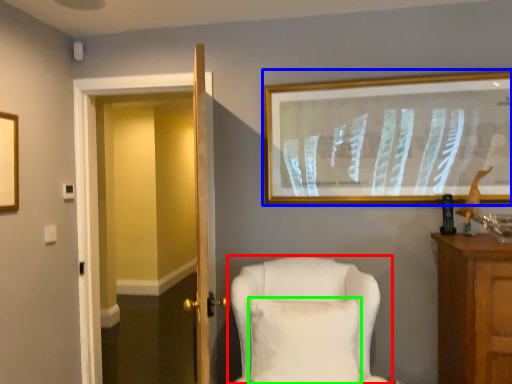
Question: Considering the real-world distances, which object is farthest from chair (highlighted by a red box)? picture frame (highlighted by a blue box) or pillow (highlighted by a green box)?

Choices:
 (A) picture frame
 (B) pillow

Answer: (A)